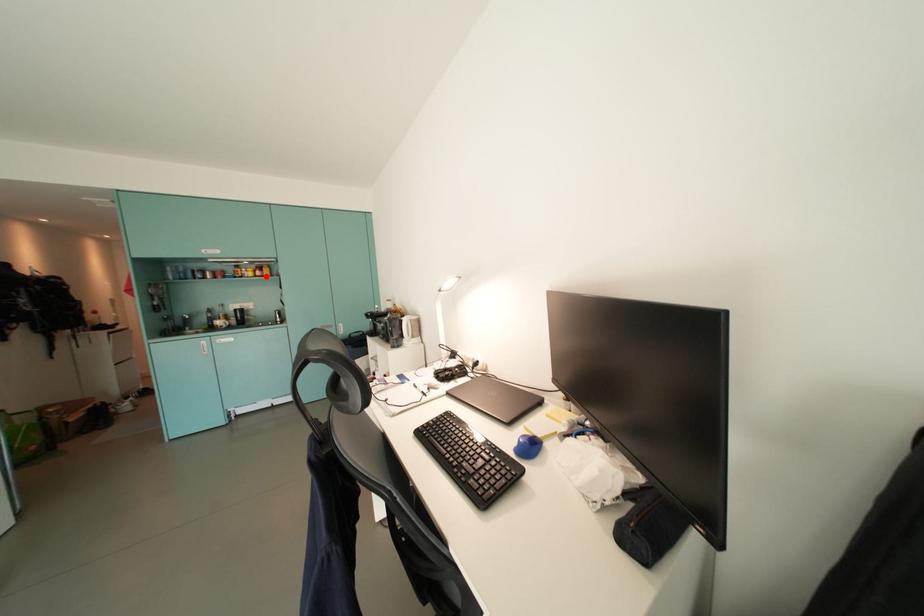
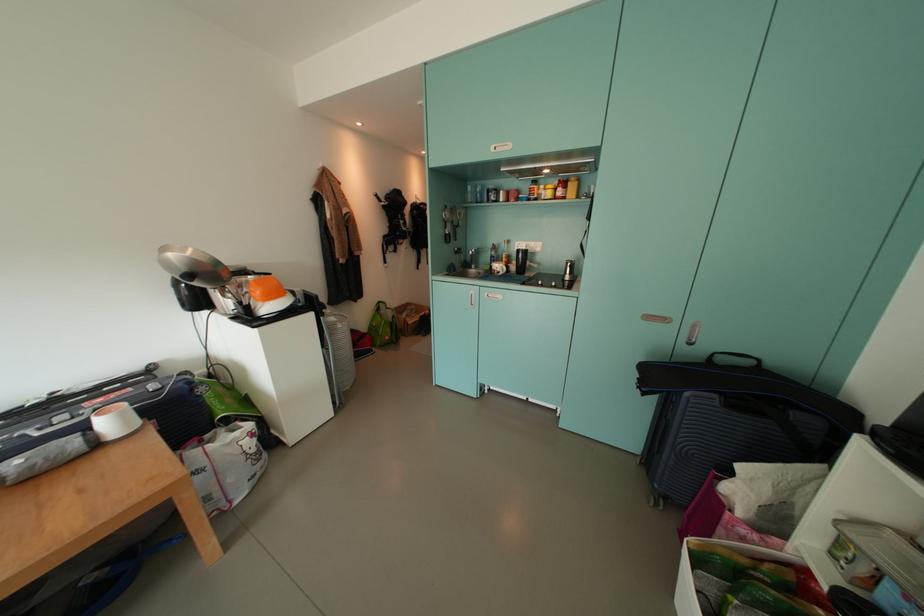
Question: A red point is marked in image1. In image2, is the corresponding 3D point closer to the camera or farther? Reply with the corresponding letter.

Choices:
 (A) The corresponding 3D point is closer.
 (B) The corresponding 3D point is farther.

Answer: (A)